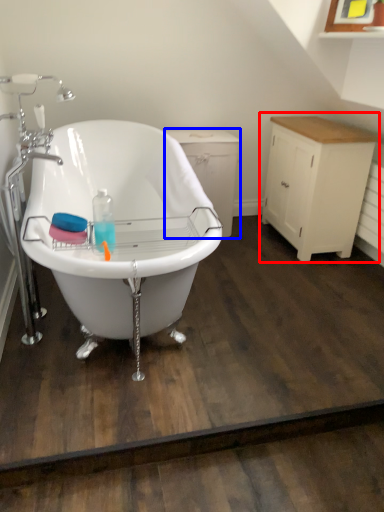
Question: Which object appears closest to the camera in this image, cabinetry (highlighted by a red box) or dresser (highlighted by a blue box)?

Choices:
 (A) cabinetry
 (B) dresser

Answer: (A)